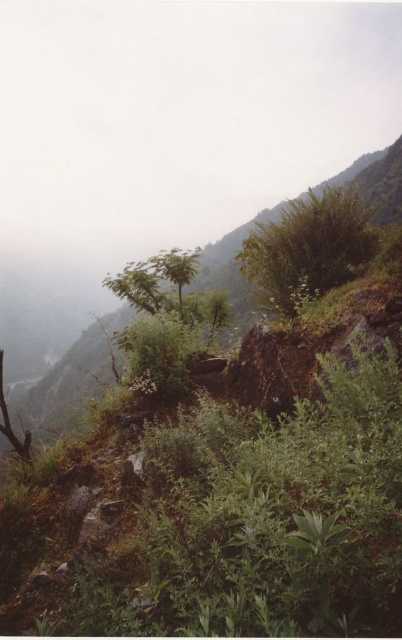
Question: Can you confirm if green leafy bush at center is positioned to the left of green leafy tree at center?

Choices:
 (A) no
 (B) yes

Answer: (A)

Question: Which point appears closest to the camera in this image?

Choices:
 (A) (159, 268)
 (B) (297, 240)
 (C) (26, 445)

Answer: (C)

Question: Considering the real-world distances, which object is farthest from the green leafy tree at left?

Choices:
 (A) green leafy tree at center
 (B) green leafy bush at center

Answer: (B)

Question: Does green leafy bush at center appear over green leafy tree at left?

Choices:
 (A) no
 (B) yes

Answer: (B)

Question: Observing the image, what is the correct spatial positioning of green leafy bush at center in reference to green leafy tree at center?

Choices:
 (A) right
 (B) left

Answer: (A)

Question: Among these points, which one is nearest to the camera?

Choices:
 (A) (344, 211)
 (B) (2, 401)
 (C) (178, 262)

Answer: (B)